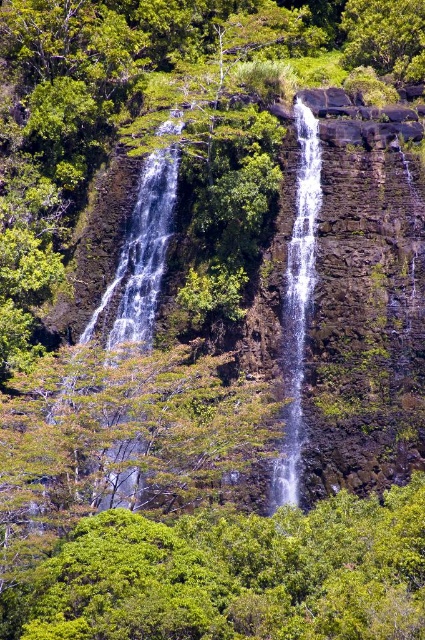
I want to click on green leafy tree at center, so click(235, 576).

Does green leafy tree at center have a greater width compared to clear water at center?

Yes, green leafy tree at center is wider than clear water at center.

Locate an element on the screen. The image size is (425, 640). green leafy tree at center is located at coordinates (235, 576).

At what (x,y) coordinates should I click in order to perform the action: click on green leafy tree at center. Please return your answer as a coordinate pair (x, y). Looking at the image, I should click on (235, 576).

Between white frothy water at center and clear water at center, which one is positioned lower?

white frothy water at center is lower down.

Does white frothy water at center have a lesser height compared to clear water at center?

Yes.

I want to click on white frothy water at center, so click(x=141, y=256).

Where is `white frothy water at center`? The width and height of the screenshot is (425, 640). white frothy water at center is located at coordinates (141, 256).

Based on the photo, which is above, green leafy tree at center or white frothy water at center?

Positioned higher is white frothy water at center.

Image resolution: width=425 pixels, height=640 pixels. What do you see at coordinates (235, 576) in the screenshot? I see `green leafy tree at center` at bounding box center [235, 576].

You are a GUI agent. You are given a task and a screenshot of the screen. Output one action in this format:
    pyautogui.click(x=<x>, y=<y>)
    Task: Click on the green leafy tree at center
    
    Given the screenshot: What is the action you would take?
    pyautogui.click(x=235, y=576)